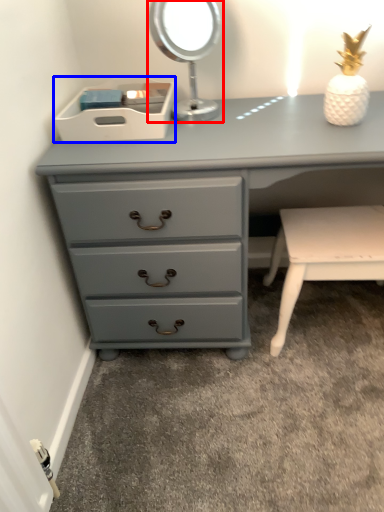
Question: Which point is closer to the camera, bedside lamp (highlighted by a red box) or storage box (highlighted by a blue box)?

Choices:
 (A) bedside lamp
 (B) storage box

Answer: (A)